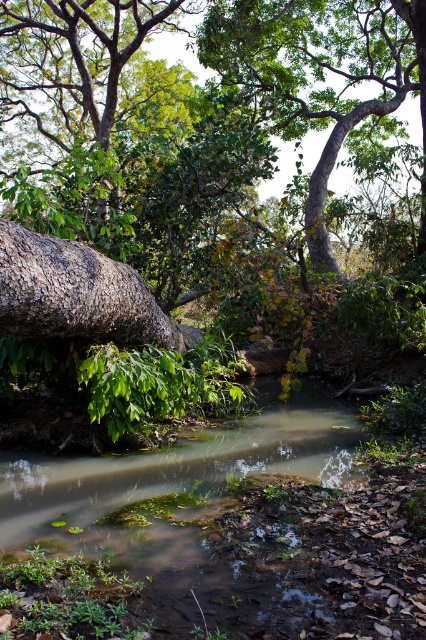
Question: In this image, where is green mossy river at center located relative to green rough bark tree at upper center?

Choices:
 (A) left
 (B) right

Answer: (A)

Question: Does green leafy tree at upper left have a larger size compared to green rough bark tree at upper center?

Choices:
 (A) yes
 (B) no

Answer: (A)

Question: Which of these objects is positioned closest to the green mossy river at center?

Choices:
 (A) green leafy tree at upper left
 (B) green rough bark tree at upper center

Answer: (A)

Question: Among these points, which one is farthest from the camera?

Choices:
 (A) (420, 243)
 (B) (9, 104)

Answer: (B)

Question: Which point is closer to the camera?

Choices:
 (A) (135, 8)
 (B) (22, 524)

Answer: (B)

Question: Can you confirm if green mossy river at center is bigger than green rough bark tree at upper center?

Choices:
 (A) no
 (B) yes

Answer: (A)